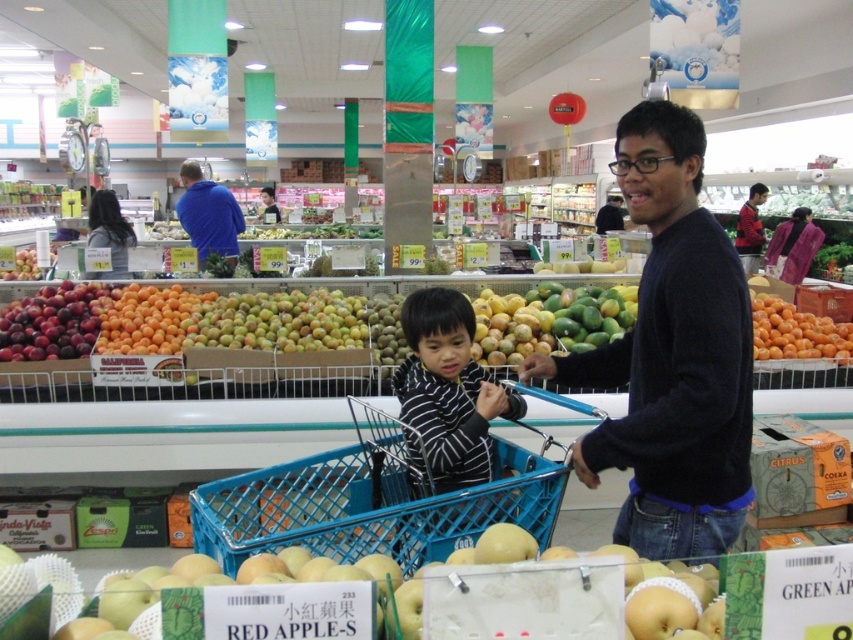
You are a customer in the grocery store and see the striped cotton shirt at center and the shiny purple plums at left. Which object is closer to you?

The striped cotton shirt at center is closer to you because it is in front of the shiny purple plums at left.

You are a store employee who needs to rearrange the items in the store. You notice the striped cotton shirt at center and the shiny purple plums at left. Which item takes up more space in the store display?

The shiny purple plums at left take up more space than the striped cotton shirt at center because the striped cotton shirt at center occupies less space than shiny purple plums at left.

You are a store employee checking the arrangement of items. You notice the striped cotton shirt at center and the shiny purple plums at left. Which item is taller?

The striped cotton shirt at center is taller than the shiny purple plums at left.